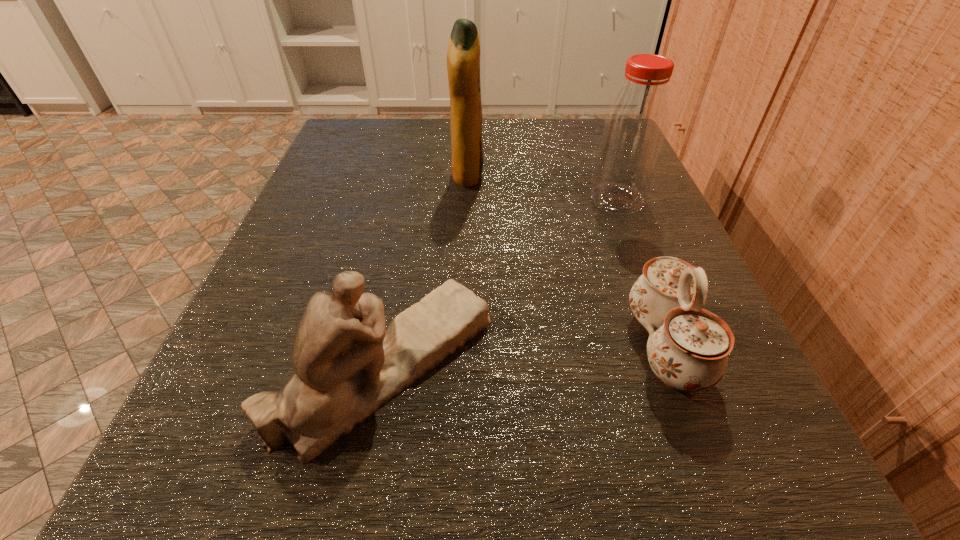
I want to click on free spot that satisfies the following two spatial constraints: 1. on the label of the detergent; 2. on the left side of the bottle, so click(x=467, y=199).